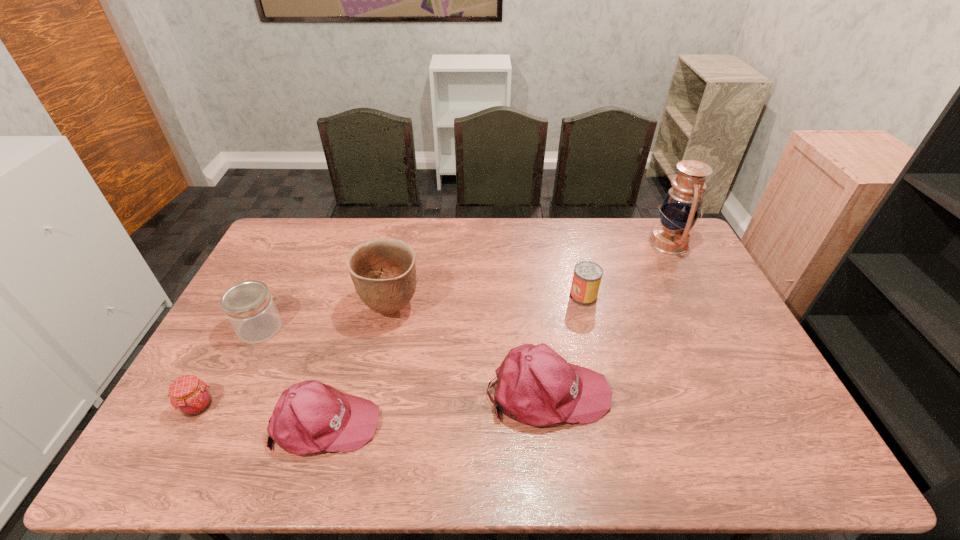
The baseball caps are evenly distributed in the image. To maintain this, where would you place another baseball cap on the right? Please point to a free space. Please provide its 2D coordinates. Your answer should be formatted as a tuple, i.e. [(x, y)], where the tuple contains the x and y coordinates of a point satisfying the conditions above.

[(747, 364)]